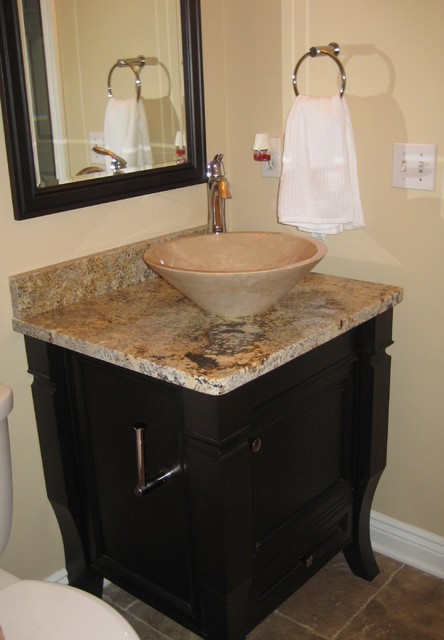
Where is `counter`? The width and height of the screenshot is (444, 640). counter is located at coordinates (241, 520).